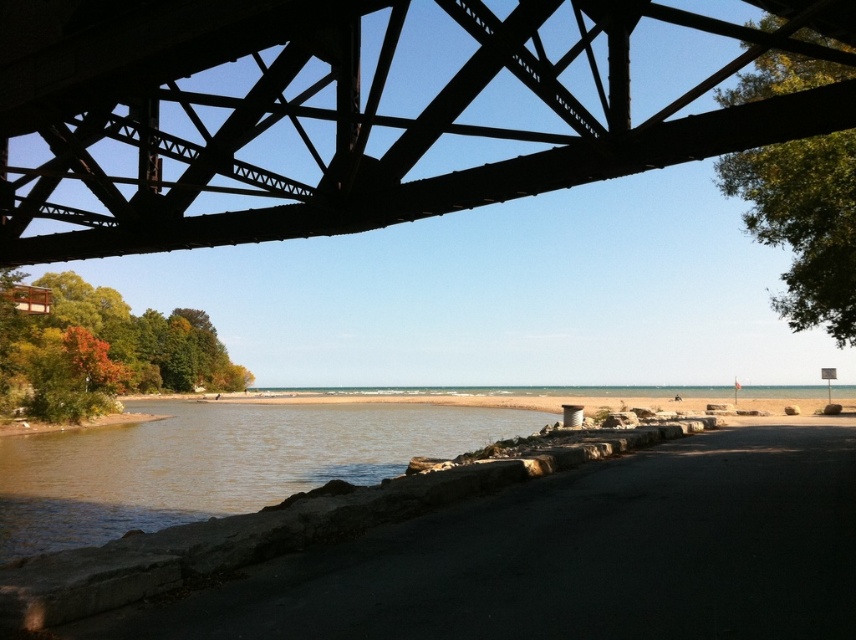
Is black steel bridge at upper center shorter than brown stone river at lower left?

No.

This screenshot has height=640, width=856. I want to click on black steel bridge at upper center, so click(x=345, y=113).

Which is in front, point (407, 147) or point (43, 525)?

Point (407, 147) is in front.

Locate an element on the screen. Image resolution: width=856 pixels, height=640 pixels. black steel bridge at upper center is located at coordinates (345, 113).